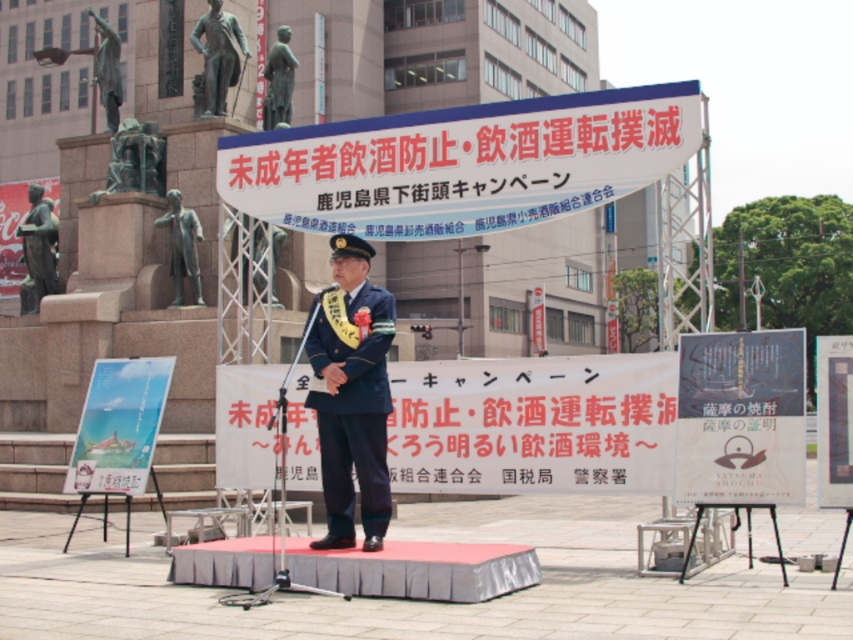
How distant is white paper banner at center from dark blue fabric uniform at center?

Answer: white paper banner at center and dark blue fabric uniform at center are 1.48 meters apart.

Between white paper banner at center and dark blue fabric uniform at center, which one is positioned higher?

Positioned higher is dark blue fabric uniform at center.

Which is in front, point (601, 492) or point (375, 317)?

Point (375, 317)

This screenshot has width=853, height=640. Identify the location of white paper banner at center. (532, 424).

Who is positioned more to the right, white plastic sign at right or matte bronze statue at left?

white plastic sign at right

Is white plastic sign at right thinner than matte bronze statue at left?

Correct, white plastic sign at right's width is less than matte bronze statue at left's.

Who is more distant from viewer, (840, 364) or (38, 220)?

The point (38, 220) is more distant.

Where is `white plastic sign at right`? The height and width of the screenshot is (640, 853). white plastic sign at right is located at coordinates (834, 420).

Measure the distance from white paper sign at upper center to dark blue fabric uniform at center.

2.16 meters

Which is more to the left, white paper sign at upper center or dark blue fabric uniform at center?

Positioned to the left is white paper sign at upper center.

This screenshot has height=640, width=853. What do you see at coordinates (462, 163) in the screenshot?
I see `white paper sign at upper center` at bounding box center [462, 163].

You are a GUI agent. You are given a task and a screenshot of the screen. Output one action in this format:
    pyautogui.click(x=<x>, y=<y>)
    Task: Click on the white paper sign at upper center
    The width and height of the screenshot is (853, 640).
    Given the screenshot: What is the action you would take?
    pyautogui.click(x=462, y=163)